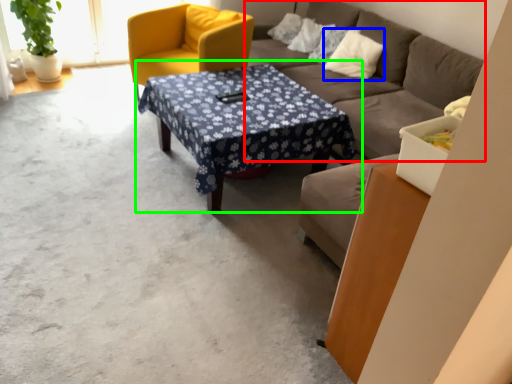
Question: Considering the real-world distances, which object is closest to studio couch (highlighted by a red box)? pillow (highlighted by a blue box) or coffee table (highlighted by a green box).

Choices:
 (A) pillow
 (B) coffee table

Answer: (A)